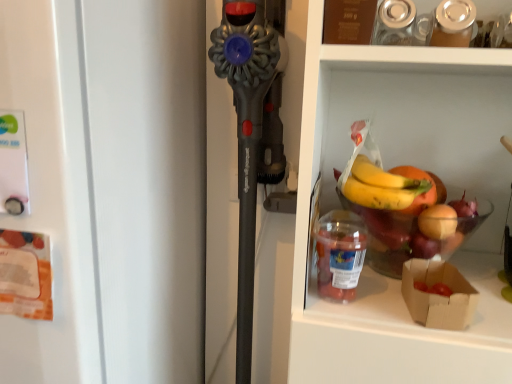
Question: Is white matte refrigerator at left positioned beyond the bounds of brown paper bag at lower right?

Choices:
 (A) no
 (B) yes

Answer: (B)

Question: Does white matte refrigerator at left have a lesser width compared to brown paper bag at lower right?

Choices:
 (A) yes
 (B) no

Answer: (B)

Question: Is white matte refrigerator at left shorter than brown paper bag at lower right?

Choices:
 (A) yes
 (B) no

Answer: (B)

Question: Is white matte refrigerator at left oriented away from brown paper bag at lower right?

Choices:
 (A) yes
 (B) no

Answer: (B)

Question: From the image's perspective, does white matte refrigerator at left appear lower than brown paper bag at lower right?

Choices:
 (A) no
 (B) yes

Answer: (B)

Question: Considering the positions of translucent plastic container at lower right and white matte refrigerator at left in the image, is translucent plastic container at lower right bigger or smaller than white matte refrigerator at left?

Choices:
 (A) small
 (B) big

Answer: (A)

Question: Is translucent plastic container at lower right inside the boundaries of white matte refrigerator at left, or outside?

Choices:
 (A) outside
 (B) inside

Answer: (A)

Question: From a real-world perspective, is translucent plastic container at lower right positioned above or below white matte refrigerator at left?

Choices:
 (A) below
 (B) above

Answer: (B)

Question: From the image's perspective, is translucent plastic container at lower right positioned above or below white matte refrigerator at left?

Choices:
 (A) above
 (B) below

Answer: (A)

Question: Is brown paper bag at lower right spatially inside translucent plastic container at lower right, or outside of it?

Choices:
 (A) outside
 (B) inside

Answer: (A)

Question: Relative to translucent plastic container at lower right, is brown paper bag at lower right in front or behind?

Choices:
 (A) behind
 (B) front

Answer: (B)

Question: Looking at their shapes, would you say brown paper bag at lower right is wider or thinner than translucent plastic container at lower right?

Choices:
 (A) wide
 (B) thin

Answer: (A)

Question: Is brown paper bag at lower right bigger or smaller than translucent plastic container at lower right?

Choices:
 (A) big
 (B) small

Answer: (B)

Question: From a real-world perspective, is brown paper bag at lower right physically located above or below white matte refrigerator at left?

Choices:
 (A) below
 (B) above

Answer: (B)

Question: Considering the positions of brown paper bag at lower right and white matte refrigerator at left in the image, is brown paper bag at lower right taller or shorter than white matte refrigerator at left?

Choices:
 (A) tall
 (B) short

Answer: (B)